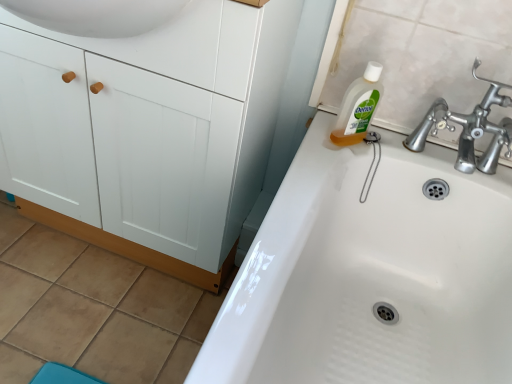
What are the coordinates of `free space in front of clear liquid soap at upper right` in the screenshot? It's located at (327, 160).